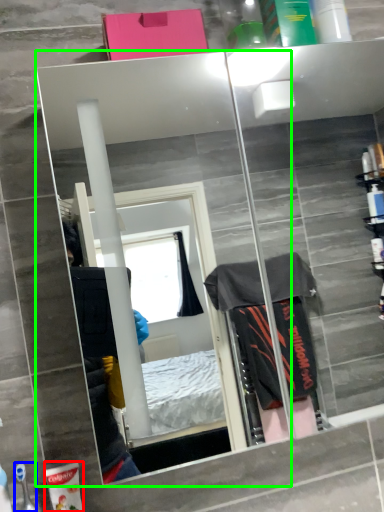
Question: Estimate the real-world distances between objects in this image. Which object is closer to toiletry (highlighted by a red box), toiletry (highlighted by a blue box) or mirror (highlighted by a green box)?

Choices:
 (A) toiletry
 (B) mirror

Answer: (A)